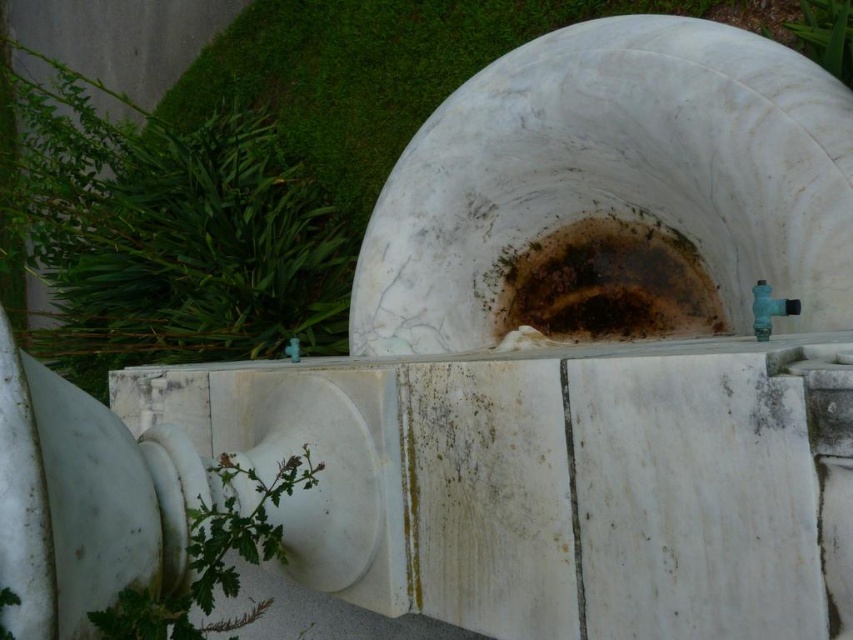
Question: Does green grass at upper left come in front of green leafy plant at lower left?

Choices:
 (A) no
 (B) yes

Answer: (A)

Question: Does green leafy plant at left have a lesser width compared to green leafy plant at lower left?

Choices:
 (A) no
 (B) yes

Answer: (A)

Question: Can you confirm if green leafy plant at left is positioned to the left of green grass at upper left?

Choices:
 (A) no
 (B) yes

Answer: (B)

Question: Which point appears farthest from the camera in this image?

Choices:
 (A) (136, 141)
 (B) (645, 259)
 (C) (317, 93)
 (D) (206, 604)

Answer: (A)

Question: Which point appears farthest from the camera in this image?

Choices:
 (A) (809, 51)
 (B) (231, 301)

Answer: (B)

Question: Which object is the farthest from the brown/marbled stone hole at center?

Choices:
 (A) green leafy plant at lower left
 (B) green leafy plant at left
 (C) green grass at upper left

Answer: (B)